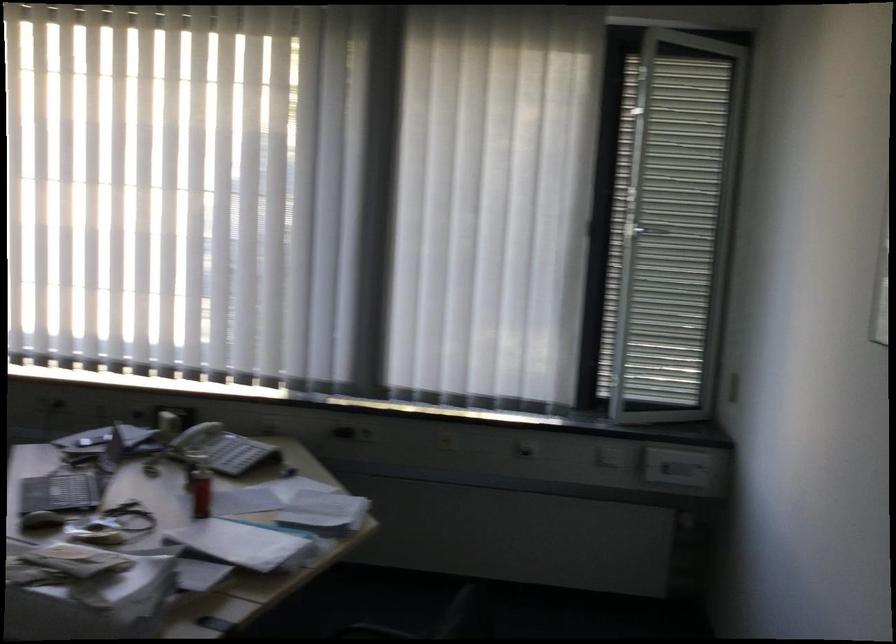
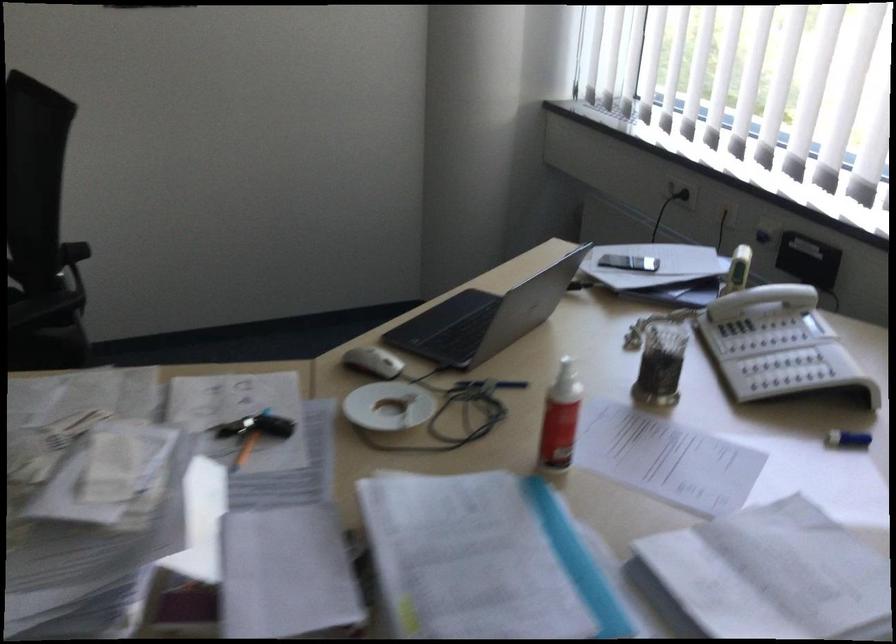
The point at (x=294, y=466) is marked in the first image. Where is the corresponding point in the second image?

(848, 439)